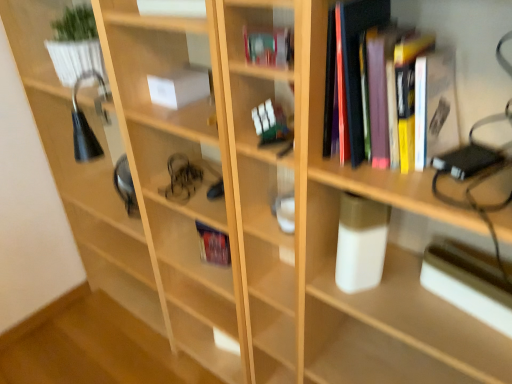
Identify the location of hardcover book at center, the 5th book in the front-to-back sequence. (213, 245).

Where is `white glossy plant pot at upper left, which is the 1th shelf in top-to-bottom order`? This screenshot has width=512, height=384. white glossy plant pot at upper left, which is the 1th shelf in top-to-bottom order is located at coordinates (54, 37).

Describe the element at coordinates (349, 75) in the screenshot. I see `hardcover books at upper right, the first book viewed from the front` at that location.

At what (x,y) coordinates should I click in order to perform the action: click on white glossy glass at center, acting as the 1th shelf starting from the bottom. Please return your answer as a coordinate pair (x, y). This screenshot has height=384, width=512. Looking at the image, I should click on (256, 105).

Measure the distance between point (286, 62) and camera.

Point (286, 62) is 83.10 centimeters from camera.

What is the approximate width of hardcover book at upper center, the 2th book positioned from the front?

1.72 inches.

What do you see at coordinates (173, 8) in the screenshot? The width and height of the screenshot is (512, 384). I see `white glossy book at upper center, positioned as the 3th book in back-to-front order` at bounding box center [173, 8].

Identify the location of hardcover book at center, the 5th book in the front-to-back sequence. (213, 245).

From a real-world perspective, is white glossy plant pot at upper left, acting as the 2th shelf starting from the front, on hardcover book at upper center, acting as the 4th book starting from the back?

No, from a real-world perspective, white glossy plant pot at upper left, acting as the 2th shelf starting from the front, is not on top of hardcover book at upper center, acting as the 4th book starting from the back.

Considering the sizes of objects white glossy plant pot at upper left, which is counted as the first shelf, starting from the left, and hardcover book at upper center, the 2th book positioned from the front, in the image provided, who is smaller, white glossy plant pot at upper left, which is counted as the first shelf, starting from the left, or hardcover book at upper center, the 2th book positioned from the front,?

hardcover book at upper center, the 2th book positioned from the front.

Is hardcover book at upper center, the 2th book positioned from the front, inside white glossy plant pot at upper left, which is counted as the first shelf, starting from the left?

No, hardcover book at upper center, the 2th book positioned from the front, is not surrounded by white glossy plant pot at upper left, which is counted as the first shelf, starting from the left.

Considering the relative positions of white glossy plant pot at upper left, arranged as the first shelf when viewed from the back, and hardcover book at upper center, the 2th book positioned from the front, in the image provided, is white glossy plant pot at upper left, arranged as the first shelf when viewed from the back, to the right of hardcover book at upper center, the 2th book positioned from the front, from the viewer's perspective?

No.

Are hardcover books at upper right, which is the 5th book from back to front, and metallic silver paperback book at right beside each other?

No, hardcover books at upper right, which is the 5th book from back to front, is not touching metallic silver paperback book at right.

Does hardcover books at upper right, the first book viewed from the front, have a larger size compared to metallic silver paperback book at right?

Correct, hardcover books at upper right, the first book viewed from the front, is larger in size than metallic silver paperback book at right.

Is hardcover books at upper right, the first book viewed from the front, to the right of metallic silver paperback book at right from the viewer's perspective?

Incorrect, hardcover books at upper right, the first book viewed from the front, is not on the right side of metallic silver paperback book at right.

From a real-world perspective, is hardcover books at upper right, the first book viewed from the front, beneath metallic silver paperback book at right?

No.

What are the coordinates of `shelf positioned vertically above the white glossy glass at center, arranged as the 2th shelf when viewed from the back (from a real-world perspective)` in the screenshot? It's located at coord(54,37).

Which object is positioned more to the right, white glossy glass at center, which is the second shelf in left-to-right order, or white glossy plant pot at upper left, the second shelf in the bottom-to-top sequence?

From the viewer's perspective, white glossy glass at center, which is the second shelf in left-to-right order, appears more on the right side.

In terms of size, does white glossy glass at center, arranged as the 2th shelf when viewed from the back, appear bigger or smaller than white glossy plant pot at upper left, the second shelf in the bottom-to-top sequence?

Clearly, white glossy glass at center, arranged as the 2th shelf when viewed from the back, is smaller in size than white glossy plant pot at upper left, the second shelf in the bottom-to-top sequence.

Does white glossy glass at center, placed as the first shelf when sorted from right to left, lie in front of white glossy plant pot at upper left, acting as the 2th shelf starting from the front?

Yes.

Is point (445, 245) more distant than point (35, 45)?

No, it is not.

Can you confirm if metallic silver paperback book at right is taller than white glossy plant pot at upper left, marked as the second shelf in a right-to-left arrangement?

No.

Is metallic silver paperback book at right closer to camera compared to white glossy plant pot at upper left, the second shelf in the bottom-to-top sequence?

Yes, it is in front of white glossy plant pot at upper left, the second shelf in the bottom-to-top sequence.

Is metallic silver paperback book at right looking in the opposite direction of white glossy plant pot at upper left, marked as the second shelf in a right-to-left arrangement?

No, metallic silver paperback book at right is not facing the opposite direction of white glossy plant pot at upper left, marked as the second shelf in a right-to-left arrangement.

Which of these two, hardcover book at upper center, the 2th book positioned from the front, or metallic silver paperback book at right, is thinner?

hardcover book at upper center, the 2th book positioned from the front.

Is hardcover book at upper center, acting as the 4th book starting from the back, inside or outside of metallic silver paperback book at right?

hardcover book at upper center, acting as the 4th book starting from the back, cannot be found inside metallic silver paperback book at right.

Considering the positions of objects hardcover book at upper center, acting as the 4th book starting from the back, and metallic silver paperback book at right in the image provided, who is more to the left, hardcover book at upper center, acting as the 4th book starting from the back, or metallic silver paperback book at right?

Positioned to the left is hardcover book at upper center, acting as the 4th book starting from the back.

Is white glossy glass at center, which is the second shelf in left-to-right order, not inside metallic silver paperback book at right?

Yes, white glossy glass at center, which is the second shelf in left-to-right order, is located beyond the bounds of metallic silver paperback book at right.

Looking at this image, who is shorter, white glossy glass at center, which is the second shelf in left-to-right order, or metallic silver paperback book at right?

Standing shorter between the two is white glossy glass at center, which is the second shelf in left-to-right order.

Find the location of a particular element. This screenshot has width=512, height=384. paperback book below the white glossy glass at center, arranged as the 2th shelf when viewed from the back (from a real-world perspective) is located at coordinates (468, 284).

From the picture: Which object is further away from the camera, white glossy glass at center, which is the second shelf in left-to-right order, or metallic silver paperback book at right?

white glossy glass at center, which is the second shelf in left-to-right order.

Based on the photo, is white paper at center, the 4th book when ordered from front to back, touching hardcover book at center, the first book when ordered from back to front?

white paper at center, the 4th book when ordered from front to back, and hardcover book at center, the first book when ordered from back to front, are not in contact.

Identify the location of book that is the 1st one above the hardcover book at center, the first book when ordered from back to front (from a real-world perspective). (181, 86).

Which point is more distant from viewer, (186, 104) or (207, 231)?

The point (207, 231) is more distant.

How far apart are white paper at center, acting as the 2th book starting from the back, and hardcover book at center, the first book when ordered from back to front?

The distance of white paper at center, acting as the 2th book starting from the back, from hardcover book at center, the first book when ordered from back to front, is 16.61 inches.

Identify the location of shelf above the hardcover book at upper center, the 2th book positioned from the front (from the image's perspective). (54, 37).

Locate an element on the screen. The image size is (512, 384). paperback book located below the hardcover books at upper right, which is the 5th book from back to front (from the image's perspective) is located at coordinates (468, 284).

Which object lies nearer to the anchor point white paper at center, acting as the 2th book starting from the back, hardcover books at upper right, the first book viewed from the front, or hardcover book at center, the 5th book in the front-to-back sequence?

Among the two, hardcover book at center, the 5th book in the front-to-back sequence, is located nearer to white paper at center, acting as the 2th book starting from the back.

From the picture: When comparing their distances from hardcover books at upper right, the first book viewed from the front, does metallic silver paperback book at right or hardcover book at upper center, the 2th book positioned from the front, seem further?

Among the two, metallic silver paperback book at right is located further to hardcover books at upper right, the first book viewed from the front.

When comparing their distances from white glossy glass at center, which is the 2th shelf in top-to-bottom order, does metallic silver paperback book at right or hardcover book at upper center, acting as the 4th book starting from the back, seem closer?

Based on the image, hardcover book at upper center, acting as the 4th book starting from the back, appears to be nearer to white glossy glass at center, which is the 2th shelf in top-to-bottom order.

Estimate the real-world distances between objects in this image. Which object is further from white glossy glass at center, which appears as the first shelf when viewed from the front, hardcover books at upper right, the first book viewed from the front, or metallic silver paperback book at right?

metallic silver paperback book at right.

Estimate the real-world distances between objects in this image. Which object is further from white glossy plant pot at upper left, which is the 1th shelf in top-to-bottom order, white paper at center, acting as the 2th book starting from the back, or hardcover book at center, the 5th book in the front-to-back sequence?

Based on the image, hardcover book at center, the 5th book in the front-to-back sequence, appears to be further to white glossy plant pot at upper left, which is the 1th shelf in top-to-bottom order.

From the image, which object appears to be farther from white paper at center, the 4th book when ordered from front to back, metallic silver paperback book at right or hardcover books at upper right, which is the 5th book from back to front?

metallic silver paperback book at right is positioned further to the anchor white paper at center, the 4th book when ordered from front to back.

Considering their positions, is hardcover book at center, the 5th book in the front-to-back sequence, positioned closer to white paper at center, acting as the 2th book starting from the back, than white glossy glass at center, which is the second shelf in left-to-right order?

The object closer to white paper at center, acting as the 2th book starting from the back, is white glossy glass at center, which is the second shelf in left-to-right order.

From the image, which object appears to be farther from white glossy plant pot at upper left, marked as the second shelf in a right-to-left arrangement, hardcover book at center, the 5th book in the front-to-back sequence, or white glossy glass at center, which is the 2th shelf in top-to-bottom order?

white glossy glass at center, which is the 2th shelf in top-to-bottom order, is further to white glossy plant pot at upper left, marked as the second shelf in a right-to-left arrangement.

You are a GUI agent. You are given a task and a screenshot of the screen. Output one action in this format:
    pyautogui.click(x=<x>, y=<y>)
    Task: Click on the shelf between white glossy plant pot at upper left, marked as the second shelf in a right-to-left arrangement, and hardcover books at upper right, the first book viewed from the front
    The image size is (512, 384).
    Given the screenshot: What is the action you would take?
    pyautogui.click(x=256, y=105)

The width and height of the screenshot is (512, 384). Find the location of `shelf between white glossy plant pot at upper left, which is the 1th shelf in top-to-bottom order, and metallic silver paperback book at right, in the horizontal direction`. shelf between white glossy plant pot at upper left, which is the 1th shelf in top-to-bottom order, and metallic silver paperback book at right, in the horizontal direction is located at coordinates (256, 105).

Where is `shelf between hardcover book at upper center, the 2th book positioned from the front, and metallic silver paperback book at right, in the horizontal direction`? The width and height of the screenshot is (512, 384). shelf between hardcover book at upper center, the 2th book positioned from the front, and metallic silver paperback book at right, in the horizontal direction is located at coordinates (256, 105).

Locate an element on the screen. The width and height of the screenshot is (512, 384). book between hardcover book at upper center, the 2th book positioned from the front, and white paper at center, the 4th book when ordered from front to back, in the front-back direction is located at coordinates (173, 8).